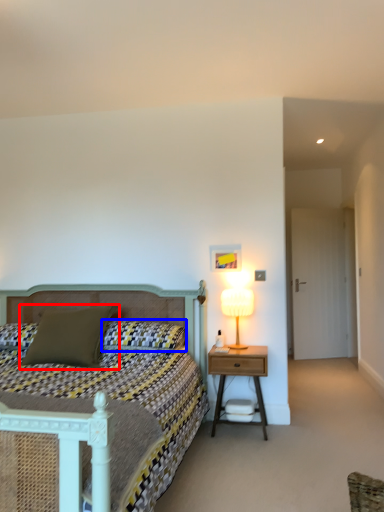
Question: Which point is further to the camera, pillow (highlighted by a red box) or pillow (highlighted by a blue box)?

Choices:
 (A) pillow
 (B) pillow

Answer: (B)